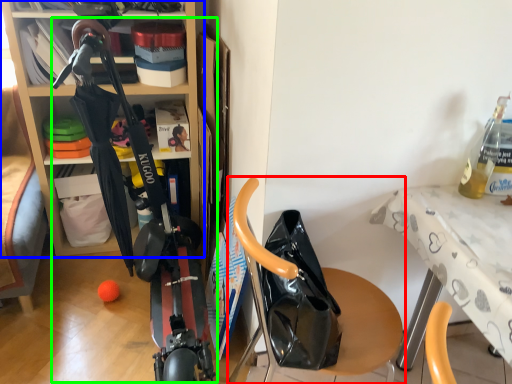
Question: Which is nearer to the furniture (highlighted by a red box)? shelf (highlighted by a blue box) or sport equipment (highlighted by a green box).

Choices:
 (A) shelf
 (B) sport equipment

Answer: (B)